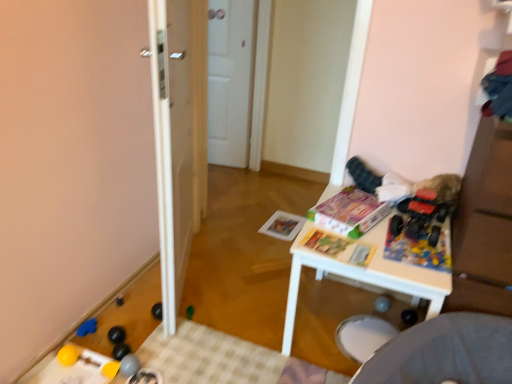
What do you see at coordinates (110, 369) in the screenshot? Image resolution: width=512 pixels, height=384 pixels. I see `rubber yellow ball at lower left, arranged as the sixth toy when viewed from the top` at bounding box center [110, 369].

In order to face green plastic toy at center, placed as the 5th toy when sorted from bottom to top, should I rotate leftwards or rightwards?

You should look left and rotate roughly 8.646 degrees.

What do you see at coordinates (419, 214) in the screenshot? I see `rubberized plastic toy at center right, arranged as the first toy when viewed from the right` at bounding box center [419, 214].

Where is `white plastic table at center`? white plastic table at center is located at coordinates (364, 275).

Would you say matte cardboard magazine at center, placed as the 2th magazine when sorted from back to front, contains blue rubber toy at lower left, the second toy when ordered from left to right?

No, matte cardboard magazine at center, placed as the 2th magazine when sorted from back to front, does not contain blue rubber toy at lower left, the second toy when ordered from left to right.

Is matte cardboard magazine at center, placed as the second magazine when sorted from front to back, turned away from blue rubber toy at lower left, the second toy when ordered from left to right?

No, matte cardboard magazine at center, placed as the second magazine when sorted from front to back, is not facing the opposite direction of blue rubber toy at lower left, the second toy when ordered from left to right.

Is matte cardboard magazine at center, placed as the 2th magazine when sorted from back to front, closer to camera compared to blue rubber toy at lower left, arranged as the fourth toy when ordered from the bottom?

Yes, matte cardboard magazine at center, placed as the 2th magazine when sorted from back to front, is closer to the viewer.

Are matte cardboard magazine at center, placed as the 2th magazine when sorted from back to front, and blue rubber toy at lower left, arranged as the fourth toy when ordered from the bottom, located far from each other?

matte cardboard magazine at center, placed as the 2th magazine when sorted from back to front, is positioned a significant distance from blue rubber toy at lower left, arranged as the fourth toy when ordered from the bottom.

Is rubber yellow ball at lower left, placed as the 3th toy when sorted from left to right, outside of rubber yellow ball at lower left, which is the sixth toy in right-to-left order?

rubber yellow ball at lower left, placed as the 3th toy when sorted from left to right, is positioned outside rubber yellow ball at lower left, which is the sixth toy in right-to-left order.

Can you confirm if rubber yellow ball at lower left, placed as the 3th toy when sorted from left to right, is wider than rubber yellow ball at lower left, which is the sixth toy in right-to-left order?

Incorrect, the width of rubber yellow ball at lower left, placed as the 3th toy when sorted from left to right, does not surpass that of rubber yellow ball at lower left, which is the sixth toy in right-to-left order.

Can you confirm if rubber yellow ball at lower left, placed as the 3th toy when sorted from left to right, is shorter than rubber yellow ball at lower left, which is the third toy from bottom to top?

Yes, rubber yellow ball at lower left, placed as the 3th toy when sorted from left to right, is shorter than rubber yellow ball at lower left, which is the third toy from bottom to top.

Measure the distance from rubber yellow ball at lower left, which is counted as the 1th toy, starting from the bottom, to rubber yellow ball at lower left, which is the fourth toy from top to bottom.

rubber yellow ball at lower left, which is counted as the 1th toy, starting from the bottom, and rubber yellow ball at lower left, which is the fourth toy from top to bottom, are 5.85 inches apart.

Based on the photo, is white matte door at center facing away from white glossy door at center?

No, white matte door at center is not facing away from white glossy door at center.

Based on the photo, from a real-world perspective, between white matte door at center and white glossy door at center, who is vertically higher?

white glossy door at center, from a real-world perspective.

Is white matte door at center not near white glossy door at center?

Yes.

Consider the image. From the image's perspective, which one is positioned lower, white matte door at center or white glossy door at center?

white glossy door at center is shown below in the image.

Does rubber yellow ball at lower left, which is the sixth toy in right-to-left order, contain green plastic toy at center, the fifth toy from the left?

No, green plastic toy at center, the fifth toy from the left, is not inside rubber yellow ball at lower left, which is the sixth toy in right-to-left order.

Could you tell me if rubber yellow ball at lower left, which is the fourth toy from top to bottom, is facing green plastic toy at center, which ranks as the second toy in right-to-left order?

No.

At what (x,y) coordinates should I click in order to perform the action: click on the 2nd toy positioned below the green plastic toy at center, which is counted as the second toy, starting from the top (from the image's perspective). Please return your answer as a coordinate pair (x, y). This screenshot has width=512, height=384. Looking at the image, I should click on (68, 355).

Which point is more forward, (133, 364) or (276, 237)?

The point (133, 364) is closer.

Which is more to the left, rubberized gray ball at lower left, the 5th toy from the top, or matte paper magazine at center, positioned as the third magazine in front-to-back order?

rubberized gray ball at lower left, the 5th toy from the top.

Identify the location of magazine below the rubberized gray ball at lower left, which is the 4th toy from left to right (from a real-world perspective). (283, 225).

Does matte paper magazine at center, positioned as the third magazine in front-to-back order, have a lesser width compared to white plastic table at center?

Yes.

Is there a large distance between matte paper magazine at center, which is the 1th magazine in back-to-front order, and white plastic table at center?

No, matte paper magazine at center, which is the 1th magazine in back-to-front order, is in close proximity to white plastic table at center.

Which object is more forward, matte paper magazine at center, which is the 1th magazine in back-to-front order, or white plastic table at center?

white plastic table at center is more forward.

Which point is more distant from viewer, (x=283, y=231) or (x=384, y=263)?

The point (x=283, y=231) is more distant.

Considering the relative sizes of rubber yellow ball at lower left, which is the 4th toy from right to left, and matte paper magazine at center, which appears as the 3th magazine when viewed from the back, in the image provided, is rubber yellow ball at lower left, which is the 4th toy from right to left, bigger than matte paper magazine at center, which appears as the 3th magazine when viewed from the back,?

Actually, rubber yellow ball at lower left, which is the 4th toy from right to left, might be smaller than matte paper magazine at center, which appears as the 3th magazine when viewed from the back.

From the image's perspective, is rubber yellow ball at lower left, which is counted as the 1th toy, starting from the bottom, located above matte paper magazine at center, which appears as the 3th magazine when viewed from the back?

No.

From the matte paper magazine at center, the first magazine positioned from the front, count the 3rd toy to the left and point to it. Please provide its 2D coordinates.

[(110, 369)]

Is rubber yellow ball at lower left, which is the 4th toy from right to left, positioned with its back to matte paper magazine at center, the first magazine positioned from the front?

rubber yellow ball at lower left, which is the 4th toy from right to left, does not have its back to matte paper magazine at center, the first magazine positioned from the front.

Identify the location of the 2nd magazine directly above the blue rubber toy at lower left, the fifth toy viewed from the right (from a real-world perspective). [350, 212].

Starting from the rubber yellow ball at lower left, which is the third toy from bottom to top, which toy is the 2nd one to the right? Please provide its 2D coordinates.

[(110, 369)]

From the image, which object appears to be farther from matte cardboard magazine at center, placed as the second magazine when sorted from front to back, matte paper magazine at center, positioned as the third magazine in front-to-back order, or green plastic toy at center, the fifth toy from the left?

green plastic toy at center, the fifth toy from the left.

When comparing their distances from rubber yellow ball at lower left, arranged as the sixth toy when viewed from the top, does white plastic table at center or white matte door at center seem further?

white matte door at center is positioned further to the anchor rubber yellow ball at lower left, arranged as the sixth toy when viewed from the top.

Estimate the real-world distances between objects in this image. Which object is closer to matte cardboard magazine at center, placed as the 2th magazine when sorted from back to front, green plastic toy at center, the fifth toy from the left, or blue rubber toy at lower left, arranged as the fourth toy when ordered from the bottom?

Among the two, green plastic toy at center, the fifth toy from the left, is located nearer to matte cardboard magazine at center, placed as the 2th magazine when sorted from back to front.

From the image, which object appears to be farther from green plastic toy at center, placed as the 5th toy when sorted from bottom to top, rubberized plastic toy at center right, which appears as the first toy when viewed from the top, or matte cardboard magazine at center, placed as the 2th magazine when sorted from back to front?

Among the two, rubberized plastic toy at center right, which appears as the first toy when viewed from the top, is located further to green plastic toy at center, placed as the 5th toy when sorted from bottom to top.

Estimate the real-world distances between objects in this image. Which object is further from rubber yellow ball at lower left, placed as the 3th toy when sorted from left to right, blue rubber toy at lower left, the second toy when ordered from left to right, or rubber yellow ball at lower left, positioned as the 1th toy in left-to-right order?

The object further to rubber yellow ball at lower left, placed as the 3th toy when sorted from left to right, is blue rubber toy at lower left, the second toy when ordered from left to right.

Looking at the image, which one is located closer to matte paper magazine at center, which appears as the 3th magazine when viewed from the back, blue rubber toy at lower left, the fifth toy viewed from the right, or green plastic toy at center, the fifth toy from the left?

Among the two, green plastic toy at center, the fifth toy from the left, is located nearer to matte paper magazine at center, which appears as the 3th magazine when viewed from the back.

When comparing their distances from rubberized plastic toy at center right, which is the 6th toy from bottom to top, does white plastic table at center or matte paper magazine at center, positioned as the third magazine in front-to-back order, seem closer?

Based on the image, white plastic table at center appears to be nearer to rubberized plastic toy at center right, which is the 6th toy from bottom to top.

Consider the image. From the image, which object appears to be farther from rubber yellow ball at lower left, which is the 4th toy from right to left, matte paper magazine at center, which is the 1th magazine in back-to-front order, or rubberized plastic toy at center right, marked as the sixth toy in a left-to-right arrangement?

matte paper magazine at center, which is the 1th magazine in back-to-front order, lies further to rubber yellow ball at lower left, which is the 4th toy from right to left, than the other object.

This screenshot has width=512, height=384. I want to click on table located between white glossy door at center and white matte door at center in the depth direction, so click(364, 275).

Identify the location of toy between rubberized gray ball at lower left, marked as the third toy in a right-to-left arrangement, and matte paper magazine at center, the first magazine positioned from the front, from left to right. (189, 312).

Locate an element on the screen. table located between rubber yellow ball at lower left, which is the 4th toy from right to left, and rubberized plastic toy at center right, marked as the sixth toy in a left-to-right arrangement, in the left-right direction is located at coordinates (364, 275).

The height and width of the screenshot is (384, 512). I want to click on magazine between matte paper magazine at center, the first magazine positioned from the front, and matte paper magazine at center, positioned as the third magazine in front-to-back order, in the front-back direction, so click(x=350, y=212).